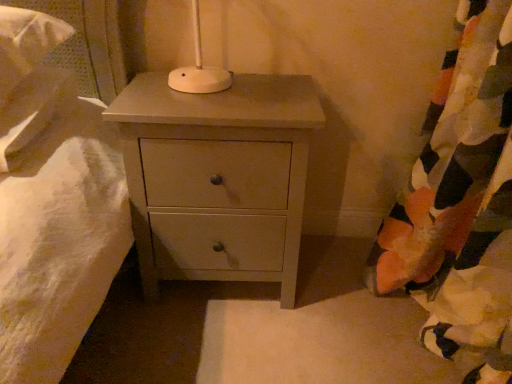
This screenshot has height=384, width=512. I want to click on matte white chest of drawers at center, so click(x=218, y=177).

This screenshot has width=512, height=384. Describe the element at coordinates (218, 177) in the screenshot. I see `matte white chest of drawers at center` at that location.

The width and height of the screenshot is (512, 384). Identify the location of floral fabric curtain at right. [461, 204].

This screenshot has width=512, height=384. What do you see at coordinates (461, 204) in the screenshot?
I see `floral fabric curtain at right` at bounding box center [461, 204].

Locate an element on the screen. The height and width of the screenshot is (384, 512). matte white chest of drawers at center is located at coordinates 218,177.

Visually, is matte white chest of drawers at center positioned to the left or to the right of floral fabric curtain at right?

From the image, it's evident that matte white chest of drawers at center is to the left of floral fabric curtain at right.

Consider the image. Is matte white chest of drawers at center closer to the viewer compared to floral fabric curtain at right?

No, matte white chest of drawers at center is further to the viewer.

Which point is more distant from viewer, (x=292, y=77) or (x=381, y=239)?

The point (x=381, y=239) is farther from the camera.

Looking at this image, from the image's perspective, is matte white chest of drawers at center below floral fabric curtain at right?

No, from the image's perspective, matte white chest of drawers at center is not beneath floral fabric curtain at right.

From a real-world perspective, is matte white chest of drawers at center on top of floral fabric curtain at right?

No, from a real-world perspective, matte white chest of drawers at center is not over floral fabric curtain at right

Can you confirm if matte white chest of drawers at center is thinner than floral fabric curtain at right?

In fact, matte white chest of drawers at center might be wider than floral fabric curtain at right.

Which of these two, matte white chest of drawers at center or floral fabric curtain at right, stands taller?

With more height is floral fabric curtain at right.

Who is bigger, matte white chest of drawers at center or floral fabric curtain at right?

floral fabric curtain at right is bigger.

Would you say matte white chest of drawers at center is inside or outside floral fabric curtain at right?

matte white chest of drawers at center cannot be found inside floral fabric curtain at right.

Is matte white chest of drawers at center not close to floral fabric curtain at right?

No.

Is matte white chest of drawers at center turned away from floral fabric curtain at right?

No.

What's the angular difference between matte white chest of drawers at center and floral fabric curtain at right's facing directions?

matte white chest of drawers at center and floral fabric curtain at right are facing 86.2 degrees away from each other.

Image resolution: width=512 pixels, height=384 pixels. Find the location of `the chest of drawers that appears below the floral fabric curtain at right (from a real-world perspective)`. the chest of drawers that appears below the floral fabric curtain at right (from a real-world perspective) is located at coordinates [x=218, y=177].

Which object is positioned more to the right, floral fabric curtain at right or matte white chest of drawers at center?

floral fabric curtain at right is more to the right.

Who is more distant, floral fabric curtain at right or matte white chest of drawers at center?

matte white chest of drawers at center.

Considering the points (477, 115) and (264, 158), which point is behind, point (477, 115) or point (264, 158)?

The point (264, 158) is farther.

From the picture: From the image's perspective, is floral fabric curtain at right on top of matte white chest of drawers at center?

Incorrect, from the image's perspective, floral fabric curtain at right is lower than matte white chest of drawers at center.

From a real-world perspective, who is located lower, floral fabric curtain at right or matte white chest of drawers at center?

From a 3D spatial view, matte white chest of drawers at center is below.

Considering the sizes of floral fabric curtain at right and matte white chest of drawers at center in the image, is floral fabric curtain at right wider or thinner than matte white chest of drawers at center?

In the image, floral fabric curtain at right appears to be more narrow than matte white chest of drawers at center.

Considering the sizes of objects floral fabric curtain at right and matte white chest of drawers at center in the image provided, who is shorter, floral fabric curtain at right or matte white chest of drawers at center?

matte white chest of drawers at center is shorter.

Who is bigger, floral fabric curtain at right or matte white chest of drawers at center?

Bigger between the two is floral fabric curtain at right.

Is floral fabric curtain at right not inside matte white chest of drawers at center?

Yes, floral fabric curtain at right is not within matte white chest of drawers at center.

Are floral fabric curtain at right and matte white chest of drawers at center far apart?

No, floral fabric curtain at right is not far away from matte white chest of drawers at center.

Is floral fabric curtain at right oriented towards matte white chest of drawers at center?

Yes, floral fabric curtain at right is aimed at matte white chest of drawers at center.

How different are the orientations of floral fabric curtain at right and matte white chest of drawers at center in degrees?

The angular difference between floral fabric curtain at right and matte white chest of drawers at center is 86.2 degrees.

Find the location of a particular element. This screenshot has height=384, width=512. chest of drawers on the left of floral fabric curtain at right is located at coordinates (218, 177).

Identify the location of chest of drawers behind the floral fabric curtain at right. This screenshot has height=384, width=512. point(218,177).

Image resolution: width=512 pixels, height=384 pixels. Identify the location of curtain in front of the matte white chest of drawers at center. (461, 204).